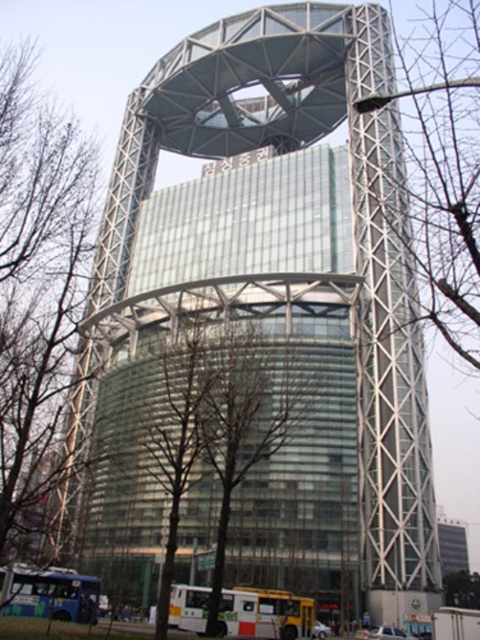
Which is more to the left, bare branches at center or white matte ambulance at lower center?

→ Positioned to the left is bare branches at center.

Is bare branches at center in front of white matte ambulance at lower center?

Yes, it is in front of white matte ambulance at lower center.

Which is in front, point (302, 628) or point (286, 609)?

Point (302, 628) is in front.

In order to click on bare branches at center in this screenshot , I will do `click(244, 424)`.

What do you see at coordinates (244, 424) in the screenshot? Image resolution: width=480 pixels, height=640 pixels. I see `bare branches at center` at bounding box center [244, 424].

Is bare branches at center shorter than green leafy tree at center?

In fact, bare branches at center may be taller than green leafy tree at center.

What do you see at coordinates (244, 424) in the screenshot? I see `bare branches at center` at bounding box center [244, 424].

Locate an element on the screen. Image resolution: width=480 pixels, height=640 pixels. bare branches at center is located at coordinates (244, 424).

Does white matte ambulance at lower center appear over green leafy tree at center?

Yes.

Locate an element on the screen. white matte ambulance at lower center is located at coordinates (264, 612).

The width and height of the screenshot is (480, 640). Describe the element at coordinates (264, 612) in the screenshot. I see `white matte ambulance at lower center` at that location.

Where is `white matte ambulance at lower center`? white matte ambulance at lower center is located at coordinates (264, 612).